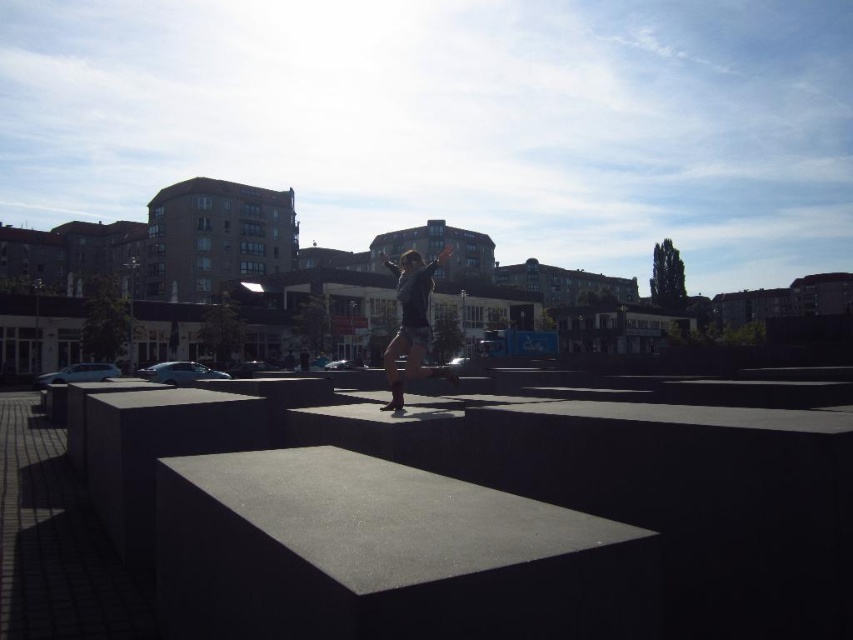
Consider the image. You are standing at the point labeled as point (479, 508) in the urban scene. What surface are you currently standing on?

You are standing on the smooth concrete ledge at center.

From the picture: You are standing at the point with coordinates point (397, 284) and want to walk towards the point with coordinates point (735, 401). Since you can only move forward, will you pass by the person standing on the concrete block?

Yes, you will pass by the person standing on the concrete block because point (735, 401) is closer to you than point (397, 284), meaning the path towards it would go past the person who is farther away.